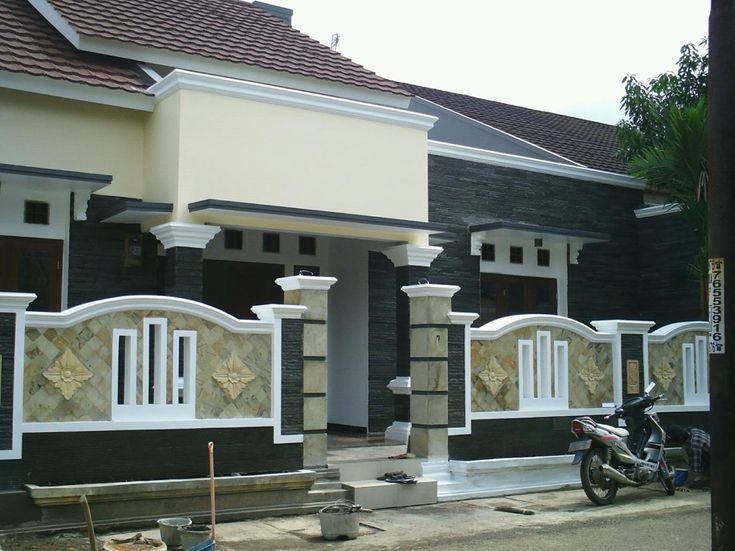
Image resolution: width=735 pixels, height=551 pixels. In order to click on steel gray bucket in this screenshot , I will do `click(348, 526)`.